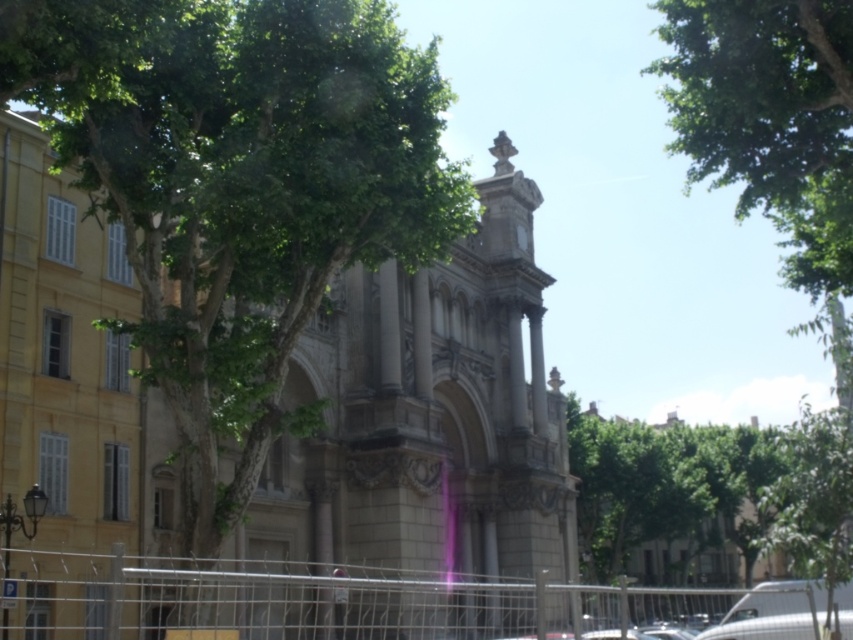
Looking at this image, is green leafy tree at center closer to the viewer compared to metallic wire fence at lower center?

No, green leafy tree at center is further to the viewer.

Is green leafy tree at center above metallic wire fence at lower center?

Yes, green leafy tree at center is above metallic wire fence at lower center.

The width and height of the screenshot is (853, 640). What are the coordinates of `green leafy tree at center` in the screenshot? It's located at (241, 189).

I want to click on green leafy tree at center, so click(241, 189).

Between metallic wire fence at lower center and green leafy tree at upper right, which one has more height?

green leafy tree at upper right is taller.

What do you see at coordinates (354, 604) in the screenshot?
I see `metallic wire fence at lower center` at bounding box center [354, 604].

Find the location of a particular element. Image resolution: width=853 pixels, height=640 pixels. metallic wire fence at lower center is located at coordinates (354, 604).

Which is behind, point (141, 230) or point (811, 180)?

The point (811, 180) is more distant.

Is point (256, 84) positioned before point (811, 8)?

Yes, it is in front of point (811, 8).

Locate an element on the screen. Image resolution: width=853 pixels, height=640 pixels. green leafy tree at center is located at coordinates (241, 189).